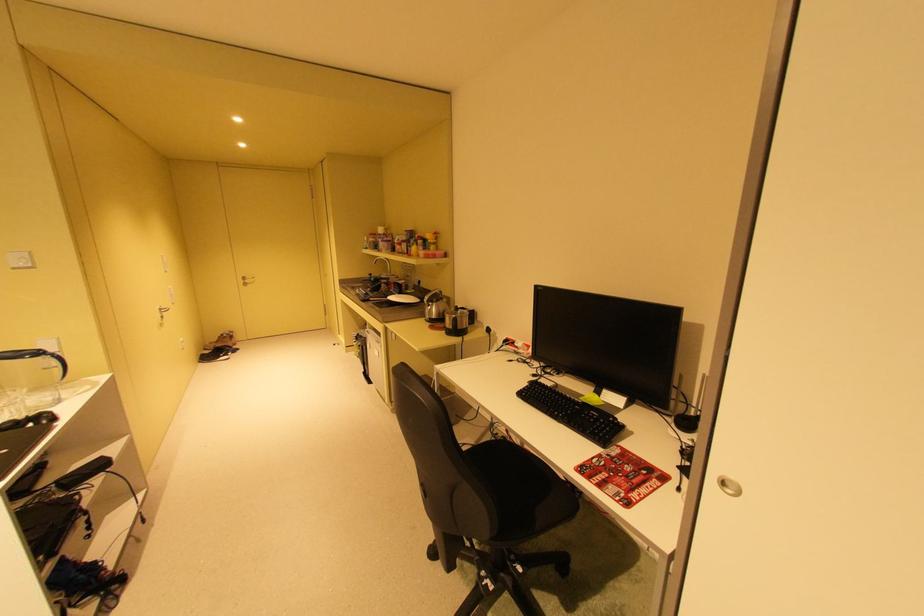
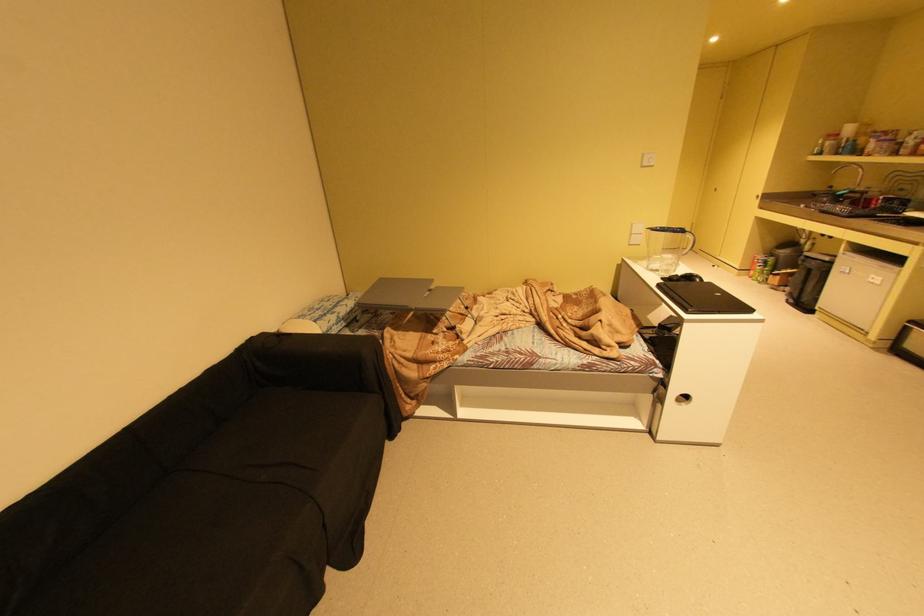
Locate, in the second image, the point that corresponds to [45,354] in the first image.

(688, 231)